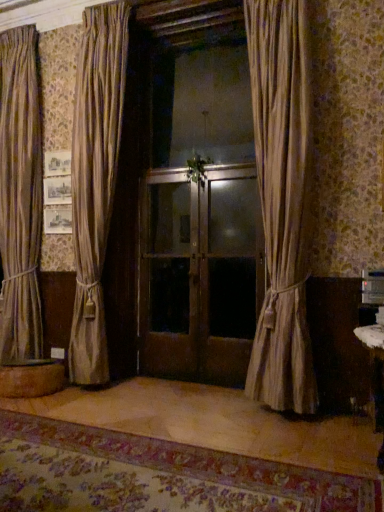
Question: Is wooden round table at lower left closer to camera compared to silky beige curtain at center, positioned as the 1th curtain in front-to-back order?

Choices:
 (A) yes
 (B) no

Answer: (B)

Question: Does wooden round table at lower left touch silky beige curtain at center, positioned as the 1th curtain in front-to-back order?

Choices:
 (A) yes
 (B) no

Answer: (B)

Question: Does wooden round table at lower left have a lesser height compared to silky beige curtain at center, which is the second curtain in back-to-front order?

Choices:
 (A) yes
 (B) no

Answer: (A)

Question: Does wooden round table at lower left turn towards silky beige curtain at center, which is the second curtain in back-to-front order?

Choices:
 (A) yes
 (B) no

Answer: (B)

Question: Is wooden round table at lower left taller than silky beige curtain at center, marked as the 1th curtain in a right-to-left arrangement?

Choices:
 (A) yes
 (B) no

Answer: (B)

Question: Is wooden round table at lower left wider than silky beige curtain at center, marked as the 1th curtain in a right-to-left arrangement?

Choices:
 (A) yes
 (B) no

Answer: (A)

Question: From a real-world perspective, is silky beige curtain at center, marked as the 1th curtain in a right-to-left arrangement, positioned over matte wooden screen door at center, the second screen door from the left, based on gravity?

Choices:
 (A) no
 (B) yes

Answer: (B)

Question: Can you confirm if silky beige curtain at center, marked as the 1th curtain in a right-to-left arrangement, is wider than matte wooden screen door at center, the second screen door from the left?

Choices:
 (A) yes
 (B) no

Answer: (A)

Question: Considering the relative sizes of silky beige curtain at center, marked as the 1th curtain in a right-to-left arrangement, and matte wooden screen door at center, the second screen door from the left, in the image provided, is silky beige curtain at center, marked as the 1th curtain in a right-to-left arrangement, smaller than matte wooden screen door at center, the second screen door from the left,?

Choices:
 (A) no
 (B) yes

Answer: (A)

Question: Could you tell me if silky beige curtain at center, the 2th curtain in the left-to-right sequence, is turned towards matte wooden screen door at center, the second screen door from the left?

Choices:
 (A) no
 (B) yes

Answer: (A)

Question: Can you confirm if silky beige curtain at center, marked as the 1th curtain in a right-to-left arrangement, is thinner than matte wooden screen door at center, the second screen door from the left?

Choices:
 (A) yes
 (B) no

Answer: (B)

Question: Can you confirm if silky beige curtain at center, marked as the 1th curtain in a right-to-left arrangement, is positioned to the right of matte wooden screen door at center, the second screen door from the left?

Choices:
 (A) no
 (B) yes

Answer: (B)

Question: Considering the relative sizes of matte brown curtain at center, the first curtain from the left, and matte wooden screen door at center, the second screen door from the left, in the image provided, is matte brown curtain at center, the first curtain from the left, bigger than matte wooden screen door at center, the second screen door from the left,?

Choices:
 (A) no
 (B) yes

Answer: (B)